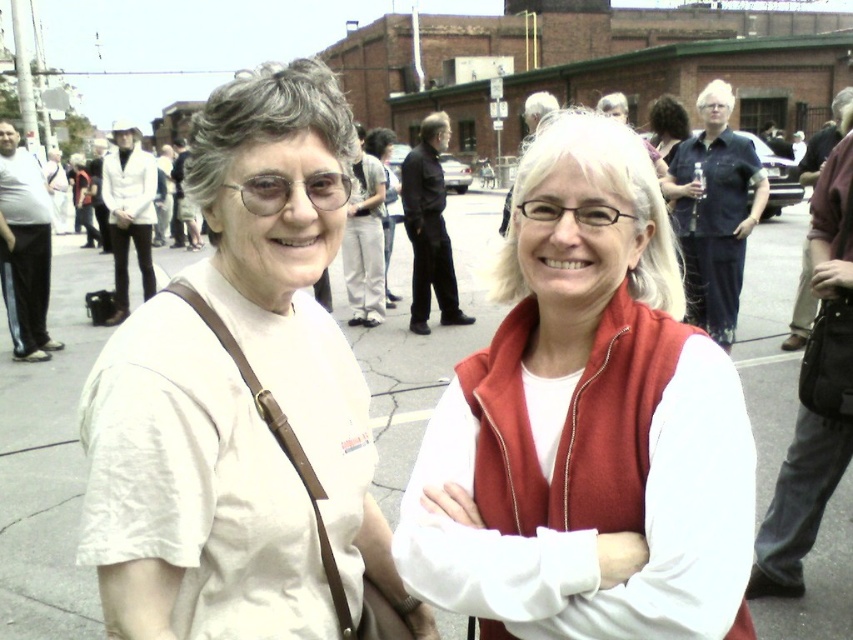
Question: Can you confirm if matte red vest at center is positioned below denim shirt at upper right?

Choices:
 (A) yes
 (B) no

Answer: (A)

Question: Which of the following is the farthest from the observer?

Choices:
 (A) (196, 486)
 (B) (737, 244)

Answer: (B)

Question: Which is nearer to the white matte shirt at left?

Choices:
 (A) matte red vest at center
 (B) gray asphalt pavement at center
 (C) denim shirt at upper right

Answer: (A)

Question: Among these points, which one is farthest from the camera?

Choices:
 (A) (766, 195)
 (B) (229, 292)

Answer: (A)

Question: Is matte red vest at center further to camera compared to denim shirt at upper right?

Choices:
 (A) yes
 (B) no

Answer: (B)

Question: Can you confirm if matte red vest at center is bigger than denim shirt at upper right?

Choices:
 (A) no
 (B) yes

Answer: (B)